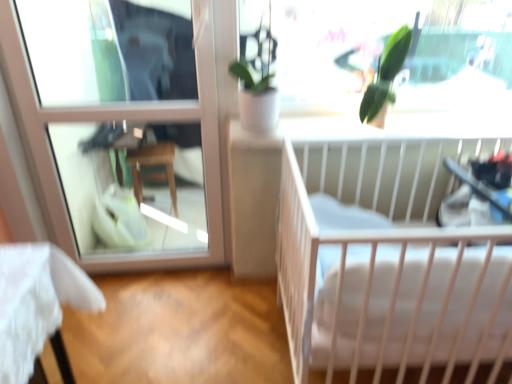
Question: Is white soft mattress at center facing away from clear glass window at upper left?

Choices:
 (A) yes
 (B) no

Answer: (B)

Question: Can you confirm if white soft mattress at center is positioned to the left of clear glass window at upper left?

Choices:
 (A) yes
 (B) no

Answer: (B)

Question: From a real-world perspective, is white soft mattress at center positioned under clear glass window at upper left based on gravity?

Choices:
 (A) no
 (B) yes

Answer: (B)

Question: Considering the relative sizes of white soft mattress at center and clear glass window at upper left in the image provided, is white soft mattress at center wider than clear glass window at upper left?

Choices:
 (A) yes
 (B) no

Answer: (B)

Question: Is white soft mattress at center positioned before clear glass window at upper left?

Choices:
 (A) no
 (B) yes

Answer: (B)

Question: Based on their sizes in the image, would you say white soft mattress at center is bigger or smaller than white matte crib at right?

Choices:
 (A) small
 (B) big

Answer: (A)

Question: In the image, is white soft mattress at center on the left side or the right side of white matte crib at right?

Choices:
 (A) left
 (B) right

Answer: (A)

Question: Is white soft mattress at center taller or shorter than white matte crib at right?

Choices:
 (A) tall
 (B) short

Answer: (B)

Question: Is white soft mattress at center wider or thinner than white matte crib at right?

Choices:
 (A) wide
 (B) thin

Answer: (B)

Question: From the image's perspective, relative to black plastic baby carriage at right, is white matte crib at right above or below?

Choices:
 (A) above
 (B) below

Answer: (B)

Question: Considering the positions of white matte crib at right and black plastic baby carriage at right in the image, is white matte crib at right wider or thinner than black plastic baby carriage at right?

Choices:
 (A) wide
 (B) thin

Answer: (A)

Question: Is white matte crib at right bigger or smaller than black plastic baby carriage at right?

Choices:
 (A) big
 (B) small

Answer: (A)

Question: Is white matte crib at right inside the boundaries of black plastic baby carriage at right, or outside?

Choices:
 (A) inside
 (B) outside

Answer: (B)

Question: In terms of size, does clear glass window at upper left appear bigger or smaller than white soft mattress at center?

Choices:
 (A) small
 (B) big

Answer: (B)

Question: From their relative heights in the image, would you say clear glass window at upper left is taller or shorter than white soft mattress at center?

Choices:
 (A) tall
 (B) short

Answer: (A)